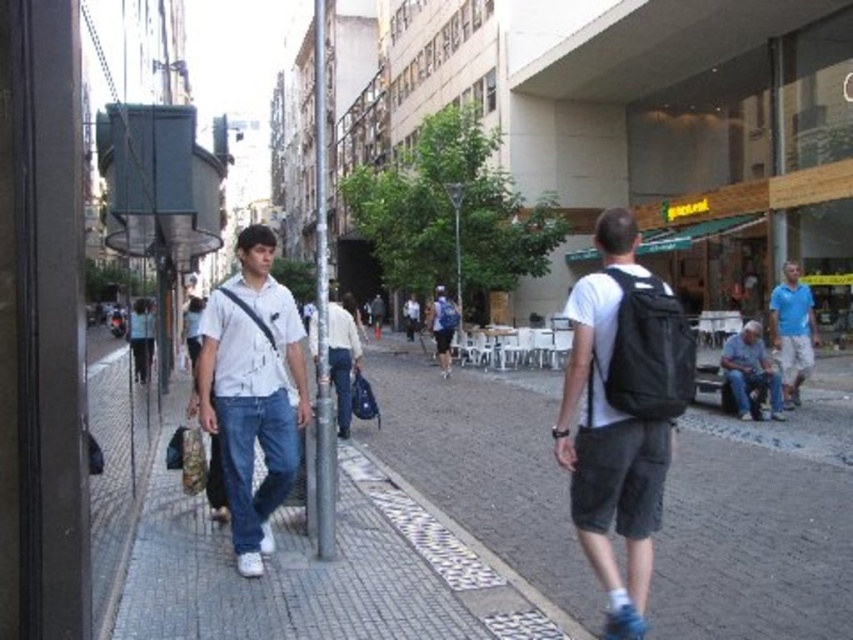
You are standing at the point marked by the coordinates point (757,529) in the image. What type of surface are you standing on?

The point (757,529) indicates brick pavement at center, so you are standing on brick pavement.

You are a delivery person needing to place both the black matte backpack at center and the denim jeans at lower right into a storage locker. The locker has a height limit of 30 cm. Which item is more likely to exceed the height limit?

The denim jeans at lower right is taller than the black matte backpack at center. Since the locker has a height limit of 30 cm, the denim jeans at lower right may exceed the height limit more than the backpack.